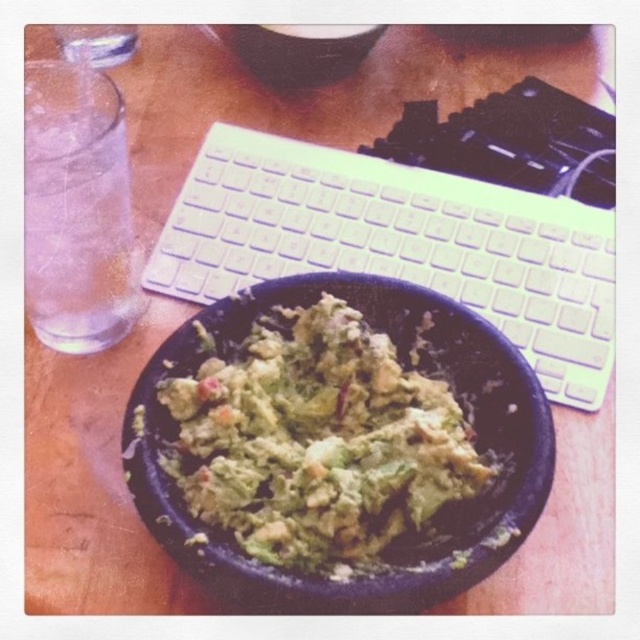
Question: Is white plastic keyboard at center positioned at the back of clear glass water at left?

Choices:
 (A) no
 (B) yes

Answer: (B)

Question: Based on their relative distances, which object is farther from the white plastic keyboard at center?

Choices:
 (A) green matte guacamole at center
 (B) clear glass water at left

Answer: (B)

Question: Among these points, which one is farthest from the camera?

Choices:
 (A) (74, 264)
 (B) (221, 284)

Answer: (B)

Question: Which object is positioned farthest from the white plastic keyboard at center?

Choices:
 (A) green matte guacamole at center
 (B) clear glass water at left

Answer: (B)

Question: Is green matte guacamole at center bigger than clear glass water at left?

Choices:
 (A) yes
 (B) no

Answer: (A)

Question: Is white plastic keyboard at center bigger than green matte guacamole at center?

Choices:
 (A) no
 (B) yes

Answer: (B)